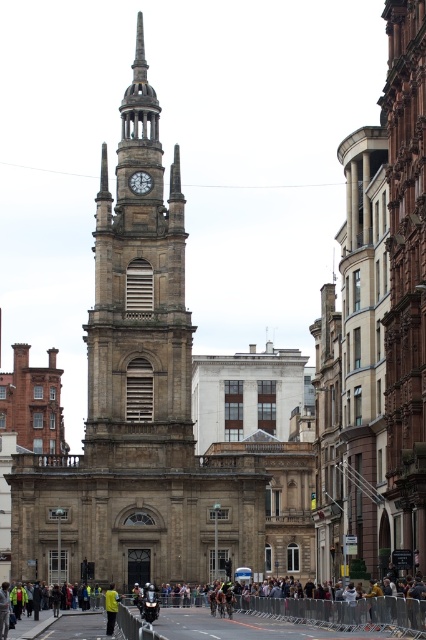
Question: Is multicolored fabric crowd at center to the left of white marble clock at upper center from the viewer's perspective?

Choices:
 (A) yes
 (B) no

Answer: (B)

Question: In this image, where is brown stone clock tower at center located relative to multicolored fabric crowd at center?

Choices:
 (A) left
 (B) right

Answer: (A)

Question: Which point is closer to the camera?

Choices:
 (A) white marble clock at upper center
 (B) multicolored fabric crowd at center
 (C) brown stone clock tower at center

Answer: (B)

Question: Which object appears closest to the camera in this image?

Choices:
 (A) multicolored fabric crowd at center
 (B) yellow fabric jacket at center

Answer: (A)

Question: Which point is closer to the camera?

Choices:
 (A) white marble clock at upper center
 (B) brown stone clock tower at center
 (C) multicolored fabric crowd at center
 (D) yellow fabric jacket at center

Answer: (C)

Question: Can you confirm if brown stone clock tower at center is positioned above yellow fabric jacket at center?

Choices:
 (A) yes
 (B) no

Answer: (A)